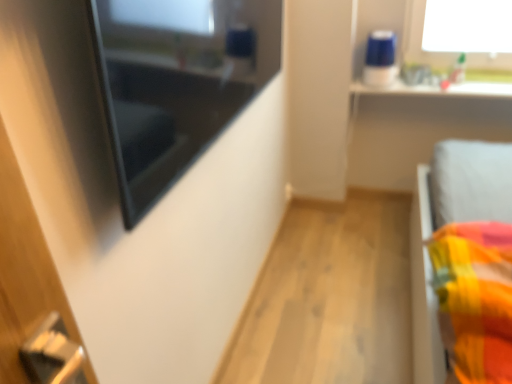
Question: Considering the relative sizes of white glossy window sill at upper right and matte black mirror at upper left in the image provided, is white glossy window sill at upper right thinner than matte black mirror at upper left?

Choices:
 (A) no
 (B) yes

Answer: (A)

Question: Considering the relative sizes of white glossy window sill at upper right and matte black mirror at upper left in the image provided, is white glossy window sill at upper right wider than matte black mirror at upper left?

Choices:
 (A) no
 (B) yes

Answer: (B)

Question: From the image's perspective, is white glossy window sill at upper right located beneath matte black mirror at upper left?

Choices:
 (A) yes
 (B) no

Answer: (B)

Question: Is white glossy window sill at upper right next to matte black mirror at upper left?

Choices:
 (A) yes
 (B) no

Answer: (B)

Question: Is white glossy window sill at upper right completely or partially outside of matte black mirror at upper left?

Choices:
 (A) yes
 (B) no

Answer: (A)

Question: Is matte black mirror at upper left completely or partially inside white glossy window sill at upper right?

Choices:
 (A) yes
 (B) no

Answer: (B)

Question: From a real-world perspective, is matte black mirror at upper left beneath white glossy window sill at upper right?

Choices:
 (A) no
 (B) yes

Answer: (A)

Question: Can you confirm if matte black mirror at upper left is bigger than white glossy window sill at upper right?

Choices:
 (A) yes
 (B) no

Answer: (A)

Question: Is matte black mirror at upper left oriented towards white glossy window sill at upper right?

Choices:
 (A) no
 (B) yes

Answer: (A)

Question: Is white glossy window sill at upper right located within matte black mirror at upper left?

Choices:
 (A) yes
 (B) no

Answer: (B)

Question: Can you confirm if matte black mirror at upper left is thinner than white glossy window sill at upper right?

Choices:
 (A) yes
 (B) no

Answer: (A)

Question: Does matte black mirror at upper left lie behind white glossy window sill at upper right?

Choices:
 (A) yes
 (B) no

Answer: (B)

Question: From a real-world perspective, relative to matte black mirror at upper left, is white glossy window sill at upper right vertically above or below?

Choices:
 (A) below
 (B) above

Answer: (A)